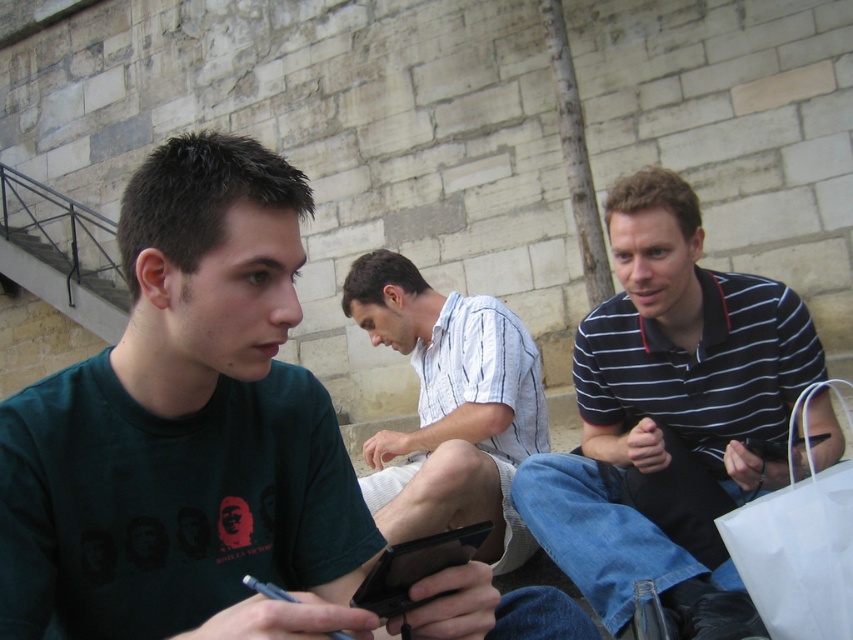
Does striped cotton shirt at right have a smaller size compared to white striped shirt at center?

Yes.

From the picture: How far apart are striped cotton shirt at right and white striped shirt at center?

A distance of 3.56 feet exists between striped cotton shirt at right and white striped shirt at center.

Find the location of `striped cotton shirt at right`. striped cotton shirt at right is located at coordinates (666, 408).

Find the location of a particular element. The image size is (853, 640). striped cotton shirt at right is located at coordinates [666, 408].

Between white paper bag at lower right and black plastic phone at center, which one appears on the left side from the viewer's perspective?

Positioned to the left is black plastic phone at center.

Is white paper bag at lower right taller than black plastic phone at center?

Indeed, white paper bag at lower right has a greater height compared to black plastic phone at center.

Locate an element on the screen. Image resolution: width=853 pixels, height=640 pixels. white paper bag at lower right is located at coordinates (799, 540).

Between striped cotton shirt at right and white paper bag at lower right, which one has less height?

With less height is white paper bag at lower right.

Can you confirm if striped cotton shirt at right is smaller than white paper bag at lower right?

No.

Who is more forward, (666, 472) or (821, 593)?

Positioned in front is point (821, 593).

Locate an element on the screen. This screenshot has width=853, height=640. striped cotton shirt at right is located at coordinates (666, 408).